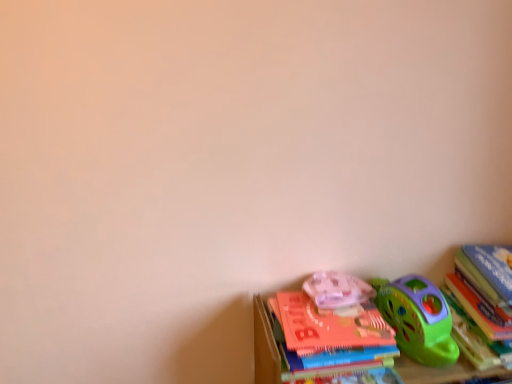
In order to click on free space in front of translucent plastic toy at lower right in this screenshot , I will do `click(340, 330)`.